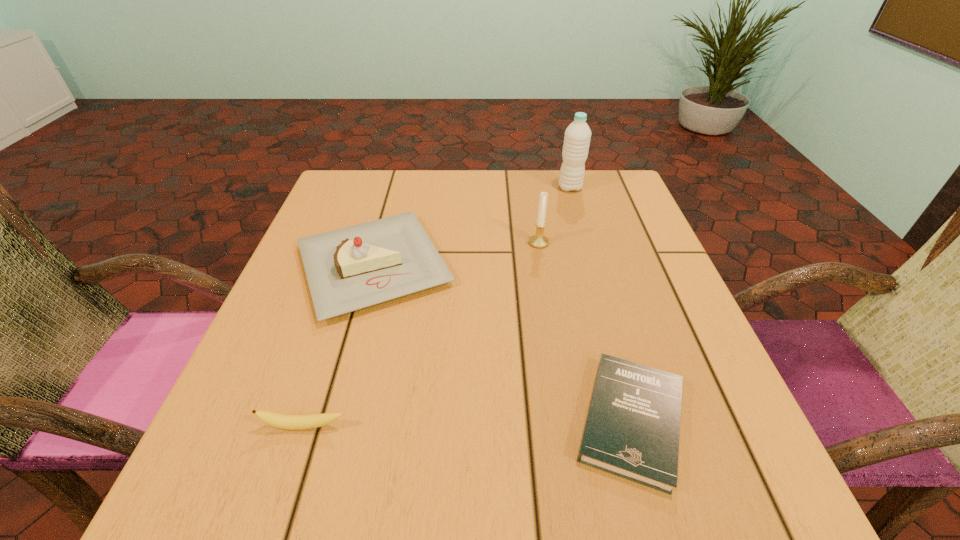
Locate an element on the screen. the tallest object is located at coordinates (577, 137).

Find the location of a particular element. water bottle is located at coordinates (577, 137).

In order to click on candle holder in this screenshot , I will do `click(539, 241)`.

Where is `cake`? Image resolution: width=960 pixels, height=540 pixels. cake is located at coordinates (351, 268).

Identify the location of the second shortest object. (290, 422).

At what (x,y) coordinates should I click in order to perform the action: click on book. Please return your answer as a coordinate pair (x, y). Looking at the image, I should click on (632, 429).

The width and height of the screenshot is (960, 540). What are the coordinates of `free space located 0.180m on the left of the water bottle` in the screenshot? It's located at (488, 188).

Locate an element on the screen. This screenshot has height=540, width=960. vacant space located 0.170m on the left of the second tallest object is located at coordinates (451, 242).

You are a GUI agent. You are given a task and a screenshot of the screen. Output one action in this format:
    pyautogui.click(x=<x>, y=<y>)
    Task: Click on the free space located on the back of the cake
    The width and height of the screenshot is (960, 540).
    Given the screenshot: What is the action you would take?
    pyautogui.click(x=397, y=178)

Where is `vacant space situated on the upward curve of the banana`? This screenshot has height=540, width=960. vacant space situated on the upward curve of the banana is located at coordinates (289, 474).